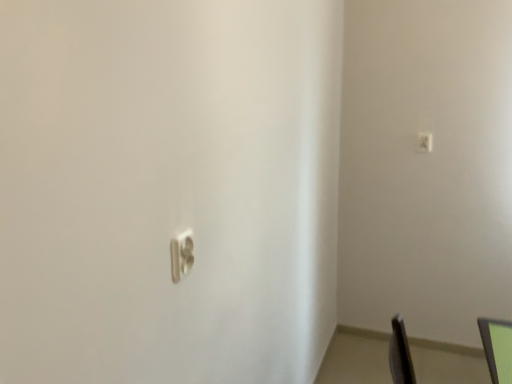
The height and width of the screenshot is (384, 512). Describe the element at coordinates (181, 255) in the screenshot. I see `white plastic light switch at center, the 1th light switch positioned from the front` at that location.

Measure the distance between white plastic light switch at center, the 2th light switch viewed from the top, and camera.

white plastic light switch at center, the 2th light switch viewed from the top, is 33.80 inches away from camera.

Image resolution: width=512 pixels, height=384 pixels. I want to click on white plastic light switch at center, the first light switch from the bottom, so point(181,255).

From a real-world perspective, is green matte monitor at lower right positioned above or below satin silver switch at upper right, the 1th light switch viewed from the top?

green matte monitor at lower right is situated lower than satin silver switch at upper right, the 1th light switch viewed from the top, in the real world.

Is green matte monitor at lower right positioned before satin silver switch at upper right, the 2th light switch when ordered from front to back?

Yes, it is.

From the image's perspective, is green matte monitor at lower right below satin silver switch at upper right, the 2th light switch in the bottom-to-top sequence?

Correct, green matte monitor at lower right appears lower than satin silver switch at upper right, the 2th light switch in the bottom-to-top sequence, in the image.

Measure the distance from green matte monitor at lower right to satin silver switch at upper right, the 1th light switch viewed from the top.

They are 1.15 meters apart.

Based on their sizes in the image, would you say white plastic light switch at center, which ranks as the second light switch in back-to-front order, is bigger or smaller than green matte monitor at lower right?

Clearly, white plastic light switch at center, which ranks as the second light switch in back-to-front order, is smaller in size than green matte monitor at lower right.

Between white plastic light switch at center, the 1th light switch positioned from the front, and green matte monitor at lower right, which one has smaller width?

Thinner between the two is white plastic light switch at center, the 1th light switch positioned from the front.

Looking at this image, choose the correct answer: Is white plastic light switch at center, the 2th light switch viewed from the top, inside green matte monitor at lower right or outside it?

white plastic light switch at center, the 2th light switch viewed from the top, is located beyond the bounds of green matte monitor at lower right.

Would you say white plastic light switch at center, which ranks as the second light switch in back-to-front order, is to the left or to the right of green matte monitor at lower right in the picture?

Clearly, white plastic light switch at center, which ranks as the second light switch in back-to-front order, is on the left of green matte monitor at lower right in the image.

Who is taller, satin silver switch at upper right, which is the 1th light switch in right-to-left order, or white plastic light switch at center, arranged as the 2th light switch when viewed from the right?

With more height is satin silver switch at upper right, which is the 1th light switch in right-to-left order.

Can we say satin silver switch at upper right, arranged as the 1th light switch when viewed from the back, lies outside white plastic light switch at center, the first light switch from the bottom?

Indeed, satin silver switch at upper right, arranged as the 1th light switch when viewed from the back, is completely outside white plastic light switch at center, the first light switch from the bottom.

Is the surface of satin silver switch at upper right, the 2th light switch in the bottom-to-top sequence, in direct contact with white plastic light switch at center, the first light switch from the bottom?

There is a gap between satin silver switch at upper right, the 2th light switch in the bottom-to-top sequence, and white plastic light switch at center, the first light switch from the bottom.

From the image's perspective, is satin silver switch at upper right, arranged as the 1th light switch when viewed from the back, on green matte monitor at lower right?

Yes, from the image's perspective, satin silver switch at upper right, arranged as the 1th light switch when viewed from the back, is on top of green matte monitor at lower right.

From a real-world perspective, who is located higher, satin silver switch at upper right, which is the 1th light switch in right-to-left order, or green matte monitor at lower right?

In real-world perspective, satin silver switch at upper right, which is the 1th light switch in right-to-left order, is above.

Could green matte monitor at lower right be considered to be inside satin silver switch at upper right, the 2th light switch when ordered from front to back?

No, green matte monitor at lower right is not inside satin silver switch at upper right, the 2th light switch when ordered from front to back.

Looking at the image, does white plastic light switch at center, arranged as the 2th light switch when viewed from the right, seem bigger or smaller compared to satin silver switch at upper right, arranged as the 1th light switch when viewed from the back?

Considering their sizes, white plastic light switch at center, arranged as the 2th light switch when viewed from the right, takes up more space than satin silver switch at upper right, arranged as the 1th light switch when viewed from the back.

Between white plastic light switch at center, which ranks as the second light switch in back-to-front order, and satin silver switch at upper right, which is the 1th light switch in right-to-left order, which one appears on the left side from the viewer's perspective?

white plastic light switch at center, which ranks as the second light switch in back-to-front order, is more to the left.

Find the location of a particular element. light switch above the white plastic light switch at center, the first light switch from the bottom (from a real-world perspective) is located at coordinates (424, 142).

Considering the positions of objects white plastic light switch at center, the first light switch from the bottom, and satin silver switch at upper right, the 2th light switch viewed from the left, in the image provided, who is in front, white plastic light switch at center, the first light switch from the bottom, or satin silver switch at upper right, the 2th light switch viewed from the left,?

white plastic light switch at center, the first light switch from the bottom.

From a real-world perspective, is green matte monitor at lower right on white plastic light switch at center, arranged as the 2th light switch when viewed from the right?

No, from a real-world perspective, green matte monitor at lower right is not over white plastic light switch at center, arranged as the 2th light switch when viewed from the right

Between green matte monitor at lower right and white plastic light switch at center, the 1th light switch positioned from the front, which one has more height?

white plastic light switch at center, the 1th light switch positioned from the front.

Who is smaller, green matte monitor at lower right or white plastic light switch at center, which ranks as the second light switch in back-to-front order?

white plastic light switch at center, which ranks as the second light switch in back-to-front order, is smaller.

The height and width of the screenshot is (384, 512). I want to click on the 2nd light switch behind when counting from the green matte monitor at lower right, so click(424, 142).

From a real-world perspective, count 1st light switchs upward from the green matte monitor at lower right and point to it. Please provide its 2D coordinates.

[(181, 255)]

Looking at the image, which one is located closer to green matte monitor at lower right, white plastic light switch at center, the 1th light switch when ordered from left to right, or satin silver switch at upper right, the 2th light switch in the bottom-to-top sequence?

white plastic light switch at center, the 1th light switch when ordered from left to right, lies closer to green matte monitor at lower right than the other object.

Which object lies further to the anchor point satin silver switch at upper right, the 2th light switch viewed from the left, white plastic light switch at center, the first light switch from the bottom, or green matte monitor at lower right?

Based on the image, white plastic light switch at center, the first light switch from the bottom, appears to be further to satin silver switch at upper right, the 2th light switch viewed from the left.

Which object lies further to the anchor point green matte monitor at lower right, satin silver switch at upper right, the 2th light switch when ordered from front to back, or white plastic light switch at center, the 1th light switch when ordered from left to right?

Among the two, satin silver switch at upper right, the 2th light switch when ordered from front to back, is located further to green matte monitor at lower right.

From the image, which object appears to be farther from white plastic light switch at center, which ranks as the second light switch in back-to-front order, green matte monitor at lower right or satin silver switch at upper right, the 2th light switch viewed from the left?

satin silver switch at upper right, the 2th light switch viewed from the left, lies further to white plastic light switch at center, which ranks as the second light switch in back-to-front order, than the other object.

Which object lies nearer to the anchor point satin silver switch at upper right, which is the 1th light switch in right-to-left order, green matte monitor at lower right or white plastic light switch at center, which ranks as the second light switch in back-to-front order?

green matte monitor at lower right is closer to satin silver switch at upper right, which is the 1th light switch in right-to-left order.

Looking at the image, which one is located closer to white plastic light switch at center, arranged as the 2th light switch when viewed from the right, satin silver switch at upper right, arranged as the 1th light switch when viewed from the back, or green matte monitor at lower right?

green matte monitor at lower right.

Where is `light switch positioned between green matte monitor at lower right and satin silver switch at upper right, the 2th light switch viewed from the left, from near to far`? Image resolution: width=512 pixels, height=384 pixels. light switch positioned between green matte monitor at lower right and satin silver switch at upper right, the 2th light switch viewed from the left, from near to far is located at coordinates (181, 255).